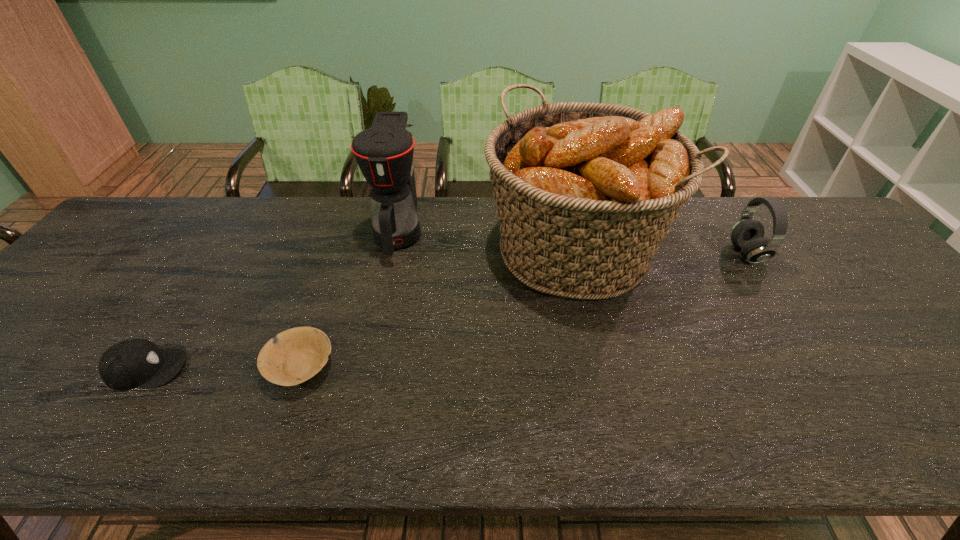
The height and width of the screenshot is (540, 960). What are the coordinates of `free region located 0.290m on the ear cups of the headset` in the screenshot? It's located at (629, 254).

You are a GUI agent. You are given a task and a screenshot of the screen. Output one action in this format:
    pyautogui.click(x=<x>, y=<y>)
    Task: Click on the vacant area situated 0.330m on the ear cups of the headset
    This screenshot has width=960, height=540.
    Given the screenshot: What is the action you would take?
    pyautogui.click(x=615, y=254)

Locate an element on the screen. vacant space located on the ear cups of the headset is located at coordinates (692, 254).

The height and width of the screenshot is (540, 960). I want to click on free space located on the front-facing side of the cap, so click(x=233, y=369).

I want to click on vacant space situated 0.180m on the left of the shortest object, so click(x=185, y=366).

Where is `basket present at the far edge`? The height and width of the screenshot is (540, 960). basket present at the far edge is located at coordinates (585, 192).

Image resolution: width=960 pixels, height=540 pixels. I want to click on coffee maker located in the far edge section of the desktop, so click(x=384, y=152).

At what (x,y) coordinates should I click in order to perform the action: click on headset at the far edge. Please return your answer as a coordinate pair (x, y). This screenshot has width=960, height=540. Looking at the image, I should click on (747, 235).

Where is `vacant space at the far edge of the desktop`? The image size is (960, 540). vacant space at the far edge of the desktop is located at coordinates (682, 217).

The image size is (960, 540). Identify the location of free region at the near edge of the desktop. (597, 441).